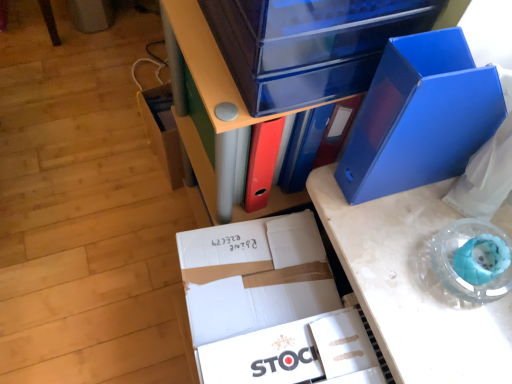
Question: Does matte blue file at center have a greater height compared to transparent plastic storage box at upper center, arranged as the second storage box when viewed from the back?

Choices:
 (A) no
 (B) yes

Answer: (B)

Question: Is matte blue file at center shorter than transparent plastic storage box at upper center, arranged as the second storage box when viewed from the back?

Choices:
 (A) yes
 (B) no

Answer: (B)

Question: Does matte blue file at center appear on the right side of transparent plastic storage box at upper center, which is counted as the first storage box, starting from the right?

Choices:
 (A) no
 (B) yes

Answer: (A)

Question: Can you confirm if matte blue file at center is thinner than transparent plastic storage box at upper center, arranged as the second storage box when viewed from the left?

Choices:
 (A) yes
 (B) no

Answer: (B)

Question: Is matte blue file at center oriented towards transparent plastic storage box at upper center, which is the first storage box in front-to-back order?

Choices:
 (A) no
 (B) yes

Answer: (A)

Question: Does matte blue file at center appear on the left side of transparent plastic storage box at upper center, which is the first storage box in front-to-back order?

Choices:
 (A) yes
 (B) no

Answer: (A)

Question: Is transparent plastic storage box at upper center, arranged as the second storage box when viewed from the left, turned away from white cardboard box at center?

Choices:
 (A) yes
 (B) no

Answer: (B)

Question: Does transparent plastic storage box at upper center, which is the first storage box in front-to-back order, turn towards white cardboard box at center?

Choices:
 (A) no
 (B) yes

Answer: (A)

Question: Does transparent plastic storage box at upper center, which is the first storage box in front-to-back order, have a greater height compared to white cardboard box at center?

Choices:
 (A) yes
 (B) no

Answer: (B)

Question: Considering the relative sizes of transparent plastic storage box at upper center, which is counted as the first storage box, starting from the right, and white cardboard box at center in the image provided, is transparent plastic storage box at upper center, which is counted as the first storage box, starting from the right, smaller than white cardboard box at center?

Choices:
 (A) no
 (B) yes

Answer: (B)

Question: From a real-world perspective, is transparent plastic storage box at upper center, which is the first storage box in front-to-back order, located higher than white cardboard box at center?

Choices:
 (A) no
 (B) yes

Answer: (B)

Question: Can you confirm if transparent plastic storage box at upper center, arranged as the second storage box when viewed from the back, is shorter than white cardboard box at center?

Choices:
 (A) yes
 (B) no

Answer: (A)

Question: From the image's perspective, does blue plastic folder at upper right, positioned as the 2th paperback book in left-to-right order, appear lower than blue plastic desk at center?

Choices:
 (A) no
 (B) yes

Answer: (A)